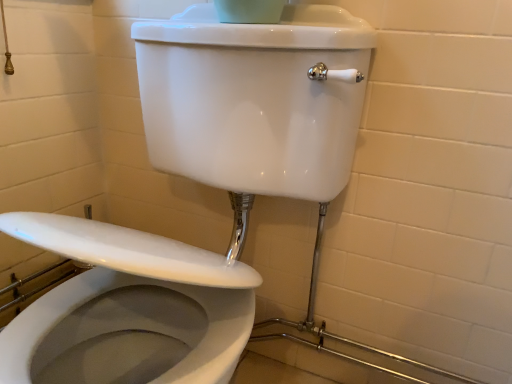
Image resolution: width=512 pixels, height=384 pixels. What are the coordinates of `white glossy sink at upper center` in the screenshot? It's located at (203, 182).

What do you see at coordinates (203, 182) in the screenshot? I see `white glossy sink at upper center` at bounding box center [203, 182].

Where is `white glossy sink at upper center`? Image resolution: width=512 pixels, height=384 pixels. white glossy sink at upper center is located at coordinates (203, 182).